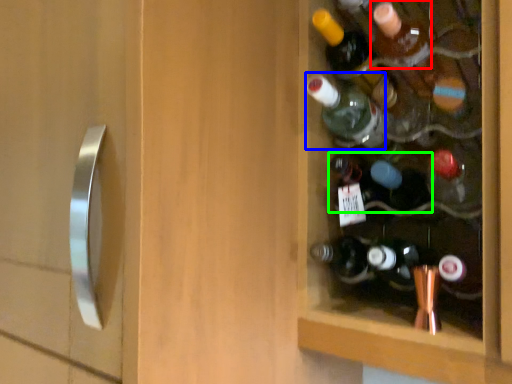
Question: Which object is positioned farthest from bottle (highlighted by a red box)? Select from bottle (highlighted by a blue box) and bottle (highlighted by a green box).

Choices:
 (A) bottle
 (B) bottle

Answer: (B)